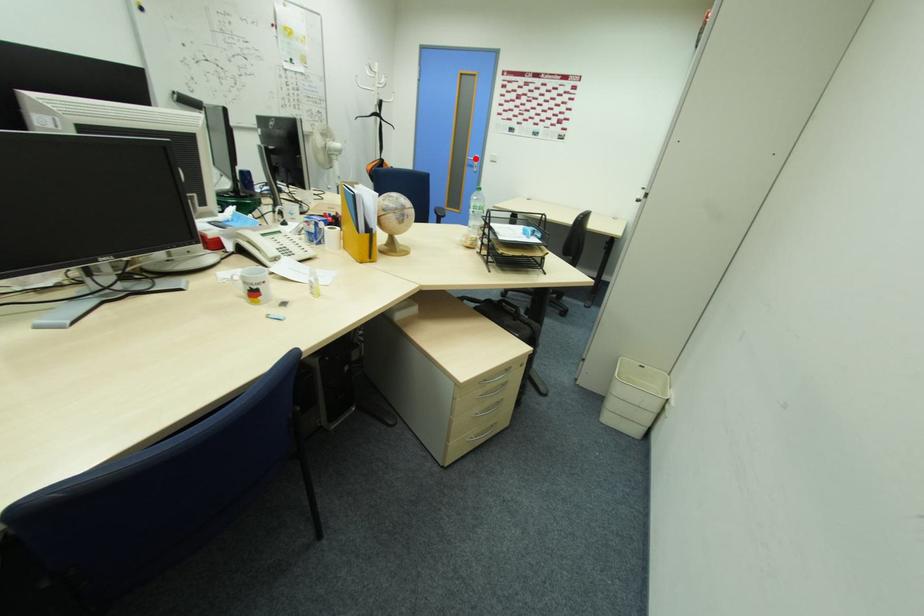
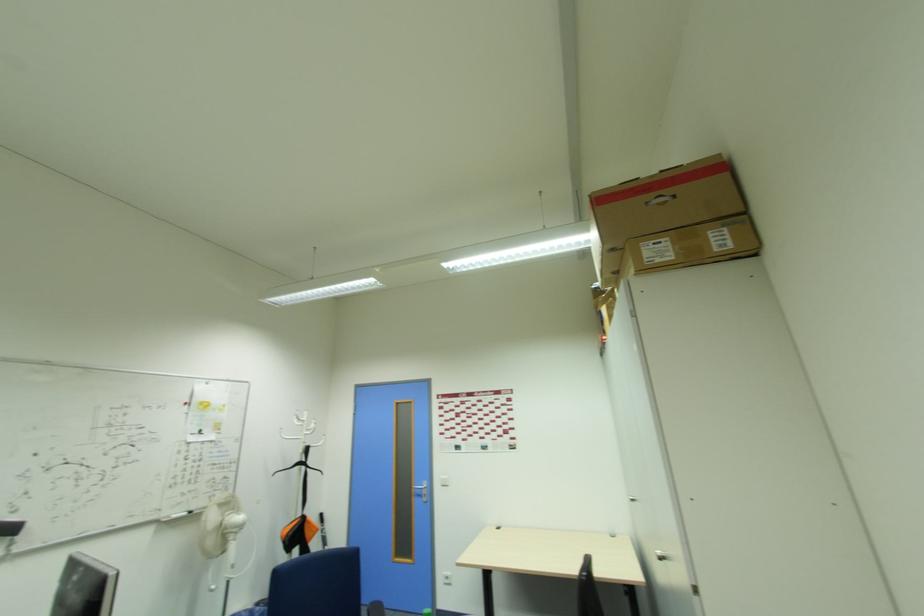
The point at the highlighted location is marked in the first image. Where is the corresponding point in the second image?

(421, 485)